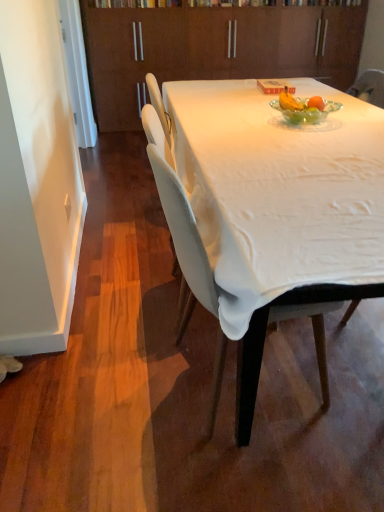
Question: Considering the relative sizes of white fabric chair at center and white cloth-covered table at center in the image provided, is white fabric chair at center shorter than white cloth-covered table at center?

Choices:
 (A) yes
 (B) no

Answer: (B)

Question: Is the surface of white fabric chair at center in direct contact with white cloth-covered table at center?

Choices:
 (A) no
 (B) yes

Answer: (A)

Question: Is white fabric chair at center wider than white cloth-covered table at center?

Choices:
 (A) yes
 (B) no

Answer: (B)

Question: Is white fabric chair at center not near white cloth-covered table at center?

Choices:
 (A) no
 (B) yes

Answer: (A)

Question: Does white fabric chair at center appear on the left side of white cloth-covered table at center?

Choices:
 (A) no
 (B) yes

Answer: (B)

Question: Is white cloth-covered table at center located within white fabric chair at center?

Choices:
 (A) no
 (B) yes

Answer: (A)

Question: Does brown wood cabinetry at upper center appear on the left side of white fabric chair at center?

Choices:
 (A) no
 (B) yes

Answer: (A)

Question: Considering the relative sizes of brown wood cabinetry at upper center and white fabric chair at center in the image provided, is brown wood cabinetry at upper center shorter than white fabric chair at center?

Choices:
 (A) yes
 (B) no

Answer: (B)

Question: Can you confirm if brown wood cabinetry at upper center is thinner than white fabric chair at center?

Choices:
 (A) no
 (B) yes

Answer: (B)

Question: Does brown wood cabinetry at upper center turn towards white fabric chair at center?

Choices:
 (A) no
 (B) yes

Answer: (B)

Question: Is white fabric chair at center at the back of brown wood cabinetry at upper center?

Choices:
 (A) yes
 (B) no

Answer: (B)

Question: Is brown wood cabinetry at upper center to the right of white fabric chair at center from the viewer's perspective?

Choices:
 (A) yes
 (B) no

Answer: (A)

Question: Is white fabric chair at center behind brown wood cabinetry at upper center?

Choices:
 (A) yes
 (B) no

Answer: (B)